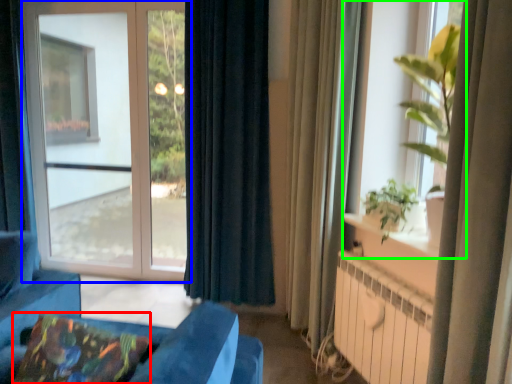
Question: Based on their relative distances, which object is farther from pillow (highlighted by a red box)? Choose from window (highlighted by a blue box) and window (highlighted by a green box).

Choices:
 (A) window
 (B) window

Answer: (A)